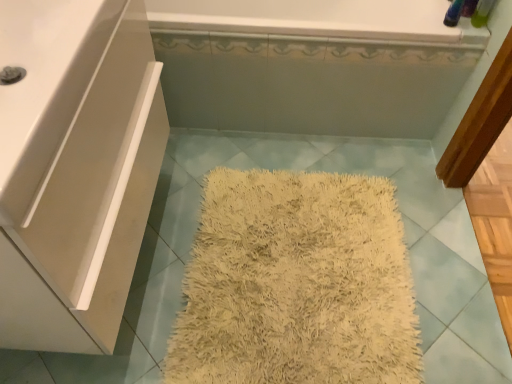
This screenshot has width=512, height=384. What do you see at coordinates (45, 87) in the screenshot? I see `white glossy sink at left` at bounding box center [45, 87].

This screenshot has height=384, width=512. What are the coordinates of `white glossy cabinet at left` in the screenshot? It's located at pos(75,168).

This screenshot has height=384, width=512. I want to click on white glossy bathtub at upper center, so click(312, 64).

Is white glossy bathtub at upper center completely or partially inside white glossy sink at left?

No, white glossy bathtub at upper center is not surrounded by white glossy sink at left.

Considering the relative sizes of white glossy sink at left and white glossy bathtub at upper center in the image provided, is white glossy sink at left thinner than white glossy bathtub at upper center?

Indeed, white glossy sink at left has a lesser width compared to white glossy bathtub at upper center.

From the image's perspective, which is above, white glossy sink at left or white glossy bathtub at upper center?

white glossy bathtub at upper center is shown above in the image.

Is white glossy sink at left oriented away from white glossy bathtub at upper center?

white glossy sink at left is not turned away from white glossy bathtub at upper center.

Considering the positions of point (147, 81) and point (74, 7), is point (147, 81) closer or farther from the camera than point (74, 7)?

Clearly, point (147, 81) is more distant from the camera than point (74, 7).

Is white glossy cabinet at left next to white glossy sink at left and touching it?

No, white glossy cabinet at left is not making contact with white glossy sink at left.

What's the angular difference between white glossy cabinet at left and white glossy sink at left's facing directions?

They differ by 2.22e-05 degrees in their facing directions.

Does white glossy cabinet at left turn towards white glossy sink at left?

No, white glossy cabinet at left is not oriented towards white glossy sink at left.

From the picture: What's the angular difference between white glossy cabinet at left and white glossy bathtub at upper center's facing directions?

The angular difference between white glossy cabinet at left and white glossy bathtub at upper center is 91 degrees.

Between white glossy cabinet at left and white glossy bathtub at upper center, which one has less height?

white glossy bathtub at upper center.

Can white glossy bathtub at upper center be found inside white glossy cabinet at left?

Actually, white glossy bathtub at upper center is outside white glossy cabinet at left.

Is white glossy cabinet at left wider or thinner than white glossy bathtub at upper center?

Clearly, white glossy cabinet at left has less width compared to white glossy bathtub at upper center.

Can you confirm if white glossy bathtub at upper center is thinner than white glossy cabinet at left?

No, white glossy bathtub at upper center is not thinner than white glossy cabinet at left.

Does white glossy bathtub at upper center appear on the left side of white glossy cabinet at left?

Incorrect, white glossy bathtub at upper center is not on the left side of white glossy cabinet at left.

Measure the distance from white glossy bathtub at upper center to white glossy cabinet at left.

white glossy bathtub at upper center is 67.90 centimeters from white glossy cabinet at left.

Is white glossy bathtub at upper center oriented towards white glossy cabinet at left?

Yes, white glossy bathtub at upper center is aimed at white glossy cabinet at left.

Is white glossy sink at left at the back of white glossy bathtub at upper center?

That's not correct — white glossy bathtub at upper center is not looking away from white glossy sink at left.

Looking at this image, considering the sizes of white glossy bathtub at upper center and white glossy sink at left in the image, is white glossy bathtub at upper center taller or shorter than white glossy sink at left?

In the image, white glossy bathtub at upper center appears to be taller than white glossy sink at left.

Where is `bath beneath the white glossy sink at left (from a real-world perspective)`? The width and height of the screenshot is (512, 384). bath beneath the white glossy sink at left (from a real-world perspective) is located at coordinates (312, 64).

Is white glossy sink at left oriented away from white glossy cabinet at left?

No.

From the image's perspective, which one is positioned lower, white glossy sink at left or white glossy cabinet at left?

white glossy cabinet at left is shown below in the image.

From a real-world perspective, which is physically above, white glossy sink at left or white glossy cabinet at left?

white glossy sink at left.

Considering the positions of points (27, 75) and (41, 130), is point (27, 75) closer to camera compared to point (41, 130)?

No, (27, 75) is further to viewer.

The height and width of the screenshot is (384, 512). What are the coordinates of `counter top above the white glossy bathtub at upper center (from a real-world perspective)` in the screenshot? It's located at (45, 87).

Identify the location of counter top above the white glossy cabinet at left (from the image's perspective). This screenshot has height=384, width=512. (45, 87).

Based on their spatial positions, is white glossy sink at left or white glossy cabinet at left closer to white glossy bathtub at upper center?

Based on the image, white glossy cabinet at left appears to be nearer to white glossy bathtub at upper center.

When comparing their distances from white glossy cabinet at left, does white glossy bathtub at upper center or white glossy sink at left seem closer?

white glossy sink at left lies closer to white glossy cabinet at left than the other object.

When comparing their distances from white glossy bathtub at upper center, does white glossy cabinet at left or white glossy sink at left seem further?

white glossy sink at left is further to white glossy bathtub at upper center.

Consider the image. When comparing their distances from white glossy sink at left, does white glossy bathtub at upper center or white glossy cabinet at left seem closer?

white glossy cabinet at left lies closer to white glossy sink at left than the other object.

Which object lies further to the anchor point white glossy sink at left, white glossy cabinet at left or white glossy bathtub at upper center?

Among the two, white glossy bathtub at upper center is located further to white glossy sink at left.

Looking at the image, which one is located closer to white glossy cabinet at left, white glossy sink at left or white glossy bathtub at upper center?

white glossy sink at left is closer to white glossy cabinet at left.

Identify the location of bathroom cabinet between white glossy sink at left and white glossy bathtub at upper center along the z-axis. (75, 168).